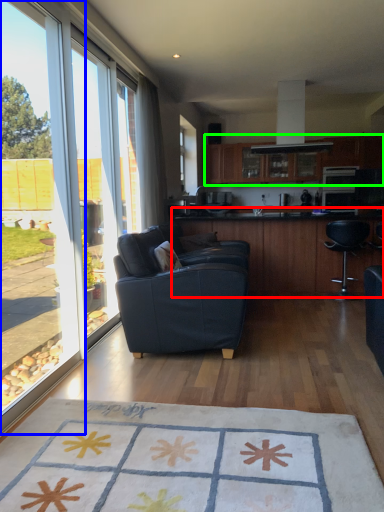
Question: Which object is positioned farthest from table (highlighted by a red box)? Select from window (highlighted by a blue box) and cabinetry (highlighted by a green box).

Choices:
 (A) window
 (B) cabinetry

Answer: (A)